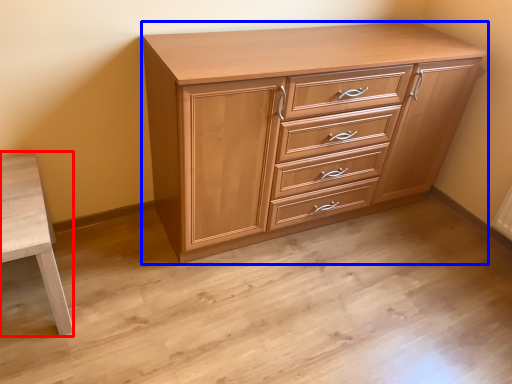
Question: Which point is closer to the camera, table (highlighted by a red box) or chest of drawers (highlighted by a blue box)?

Choices:
 (A) table
 (B) chest of drawers

Answer: (A)